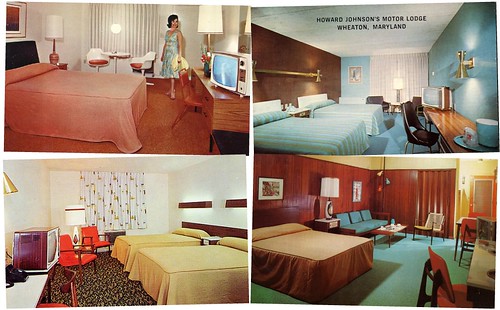
This screenshot has width=500, height=310. Identify the location of phone. (13, 277).